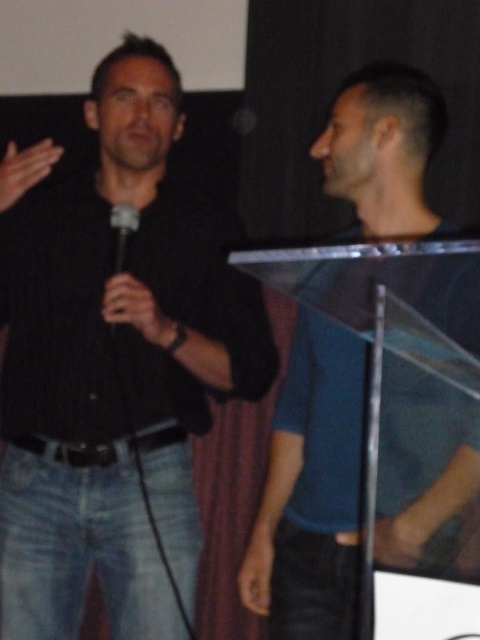
Question: Does blue matte shirt at center appear on the right side of black plastic microphone at center?

Choices:
 (A) no
 (B) yes

Answer: (B)

Question: Which of the following is the farthest from the observer?

Choices:
 (A) (134, 221)
 (B) (477, 486)
 (C) (115, 486)

Answer: (C)

Question: Estimate the real-world distances between objects in this image. Which object is farther from the black matte shirt at left?

Choices:
 (A) black matte microphone at left
 (B) blue matte shirt at center
 (C) black plastic microphone at center

Answer: (B)

Question: Which object is farther from the camera taking this photo?

Choices:
 (A) black matte microphone at left
 (B) blue matte shirt at center
 (C) black plastic microphone at center

Answer: (B)

Question: Where is black matte microphone at left located in relation to black plastic microphone at center in the image?

Choices:
 (A) left
 (B) right

Answer: (B)

Question: Is black matte shirt at left smaller than black matte microphone at left?

Choices:
 (A) no
 (B) yes

Answer: (A)